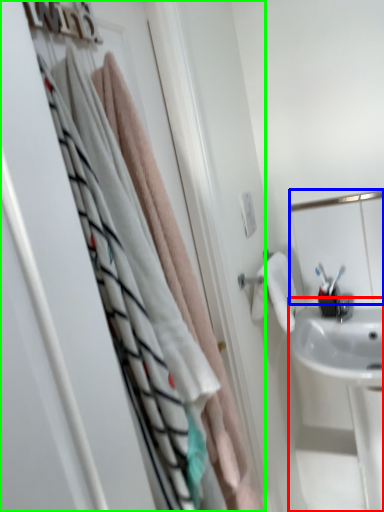
Question: Considering the real-world distances, which object is closest to sink (highlighted by a red box)? mirror (highlighted by a blue box) or closet (highlighted by a green box).

Choices:
 (A) mirror
 (B) closet

Answer: (A)